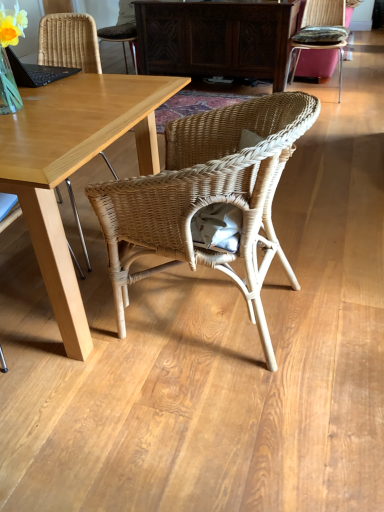
Question: Can we say rattan cushion at upper right, the 3th chair viewed from the front, lies outside dark wood cabinet at center?

Choices:
 (A) no
 (B) yes

Answer: (B)

Question: Is rattan cushion at upper right, the 3th chair viewed from the front, further to the viewer compared to dark wood cabinet at center?

Choices:
 (A) no
 (B) yes

Answer: (A)

Question: Considering the relative positions of rattan cushion at upper right, arranged as the 3th chair when viewed from the left, and dark wood cabinet at center in the image provided, is rattan cushion at upper right, arranged as the 3th chair when viewed from the left, in front of dark wood cabinet at center?

Choices:
 (A) no
 (B) yes

Answer: (B)

Question: Can you confirm if rattan cushion at upper right, acting as the third chair starting from the bottom, is bigger than dark wood cabinet at center?

Choices:
 (A) yes
 (B) no

Answer: (B)

Question: From a real-world perspective, is rattan cushion at upper right, which appears as the 1th chair when viewed from the back, physically below dark wood cabinet at center?

Choices:
 (A) no
 (B) yes

Answer: (B)

Question: In terms of width, does light wood desk at center look wider or thinner when compared to woven wicker chair at center, the second chair viewed from the top?

Choices:
 (A) wide
 (B) thin

Answer: (A)

Question: Relative to woven wicker chair at center, which ranks as the 3th chair in right-to-left order, is light wood desk at center in front or behind?

Choices:
 (A) front
 (B) behind

Answer: (A)

Question: Would you say light wood desk at center is inside or outside woven wicker chair at center, which ranks as the 2th chair in back-to-front order?

Choices:
 (A) inside
 (B) outside

Answer: (B)

Question: From their relative heights in the image, would you say light wood desk at center is taller or shorter than woven wicker chair at center, which ranks as the 2th chair in back-to-front order?

Choices:
 (A) tall
 (B) short

Answer: (B)

Question: From a real-world perspective, is natural wicker chair at center, arranged as the 2th chair when viewed from the left, physically located above or below dark wood cabinet at center?

Choices:
 (A) above
 (B) below

Answer: (B)

Question: Does point (208, 258) appear closer or farther from the camera than point (183, 33)?

Choices:
 (A) farther
 (B) closer

Answer: (B)

Question: In terms of height, does natural wicker chair at center, the second chair positioned from the right, look taller or shorter compared to dark wood cabinet at center?

Choices:
 (A) tall
 (B) short

Answer: (A)

Question: Visually, is natural wicker chair at center, which is the third chair from back to front, positioned to the left or to the right of dark wood cabinet at center?

Choices:
 (A) left
 (B) right

Answer: (A)

Question: In terms of size, does woven wicker chair at center, the second chair viewed from the top, appear bigger or smaller than light wood desk at center?

Choices:
 (A) big
 (B) small

Answer: (B)

Question: From a real-world perspective, relative to light wood desk at center, is woven wicker chair at center, the 2th chair ordered from the bottom, vertically above or below?

Choices:
 (A) below
 (B) above

Answer: (B)